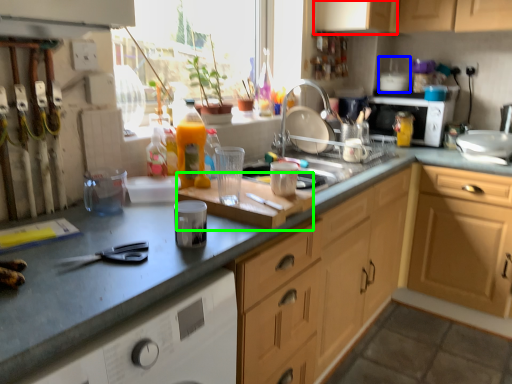
Question: Which is nearer to the cabinetry (highlighted by a red box)? appliance (highlighted by a blue box) or cutting board (highlighted by a green box).

Choices:
 (A) appliance
 (B) cutting board

Answer: (A)